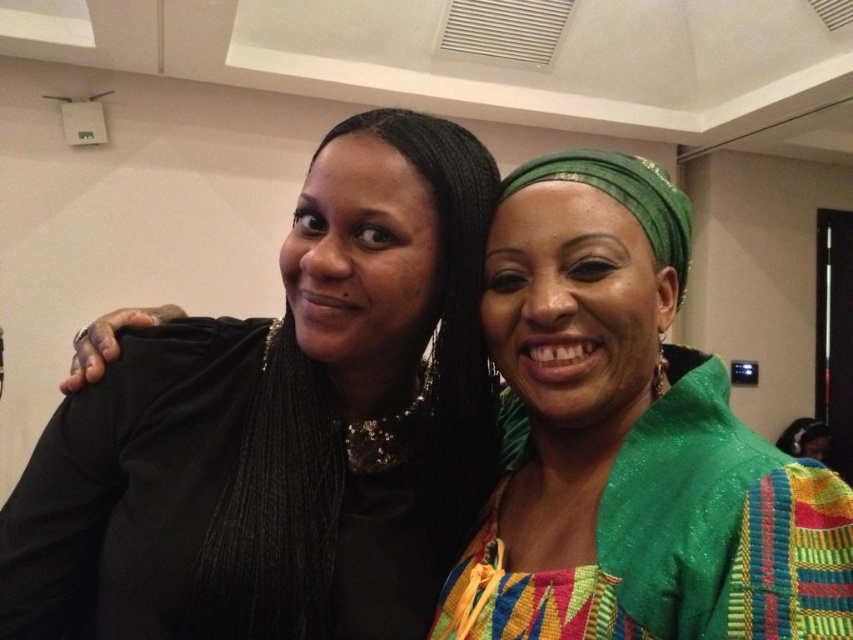
Can you confirm if black velvet sweater at left is positioned above green woven fabric at center?

No.

Is black velvet sweater at left shorter than green woven fabric at center?

No, black velvet sweater at left is not shorter than green woven fabric at center.

Describe the element at coordinates (282, 428) in the screenshot. The width and height of the screenshot is (853, 640). I see `black velvet sweater at left` at that location.

Identify the location of black velvet sweater at left. The height and width of the screenshot is (640, 853). (282, 428).